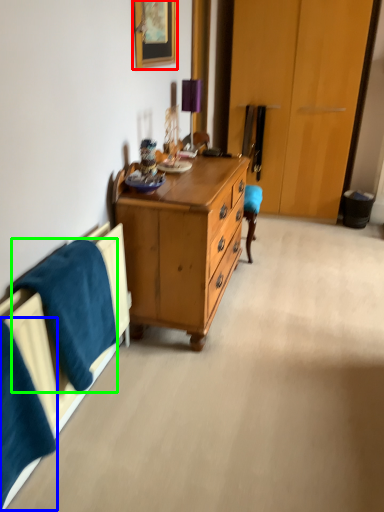
Question: Which object is the closest to the picture frame (highlighted by a red box)? Choose among these: blanket (highlighted by a blue box) or blanket (highlighted by a green box).

Choices:
 (A) blanket
 (B) blanket

Answer: (B)